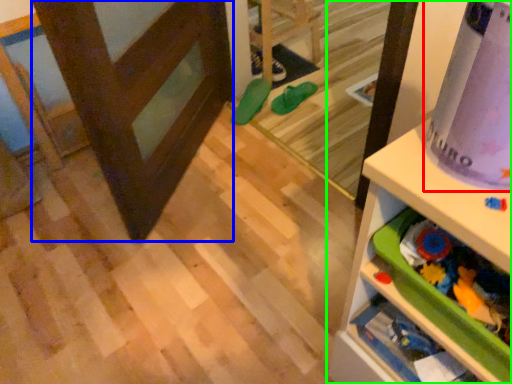
Question: Which object is the farthest from wrapping paper (highlighted by a red box)? Choose among these: screen door (highlighted by a blue box) or shelf (highlighted by a green box).

Choices:
 (A) screen door
 (B) shelf

Answer: (A)